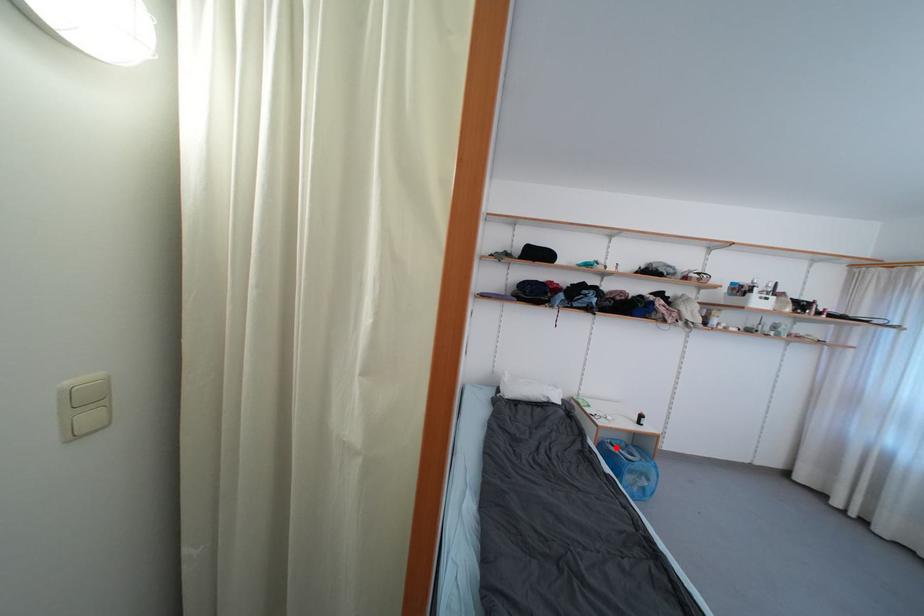
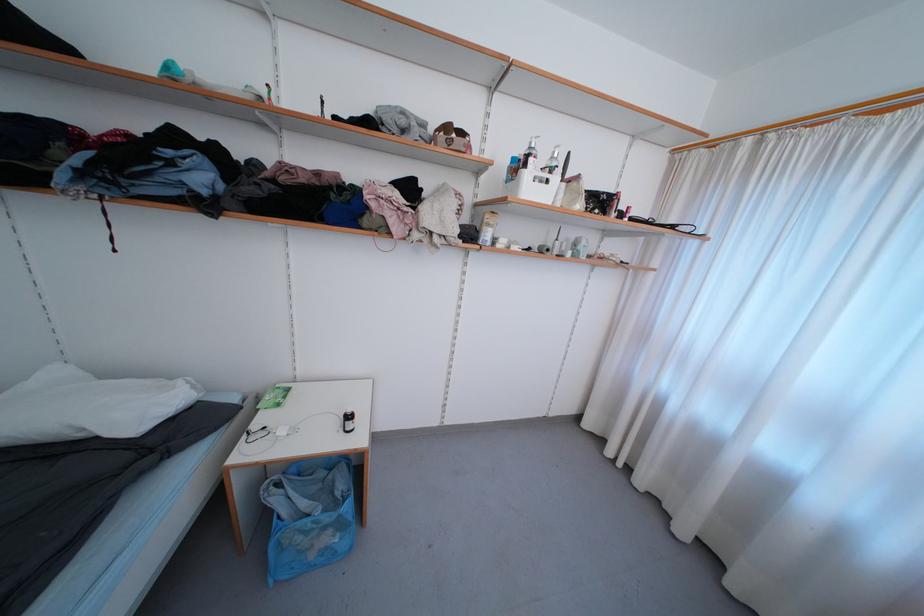
The point at the highlighted location is marked in the first image. Where is the corresponding point in the second image?

(284, 488)